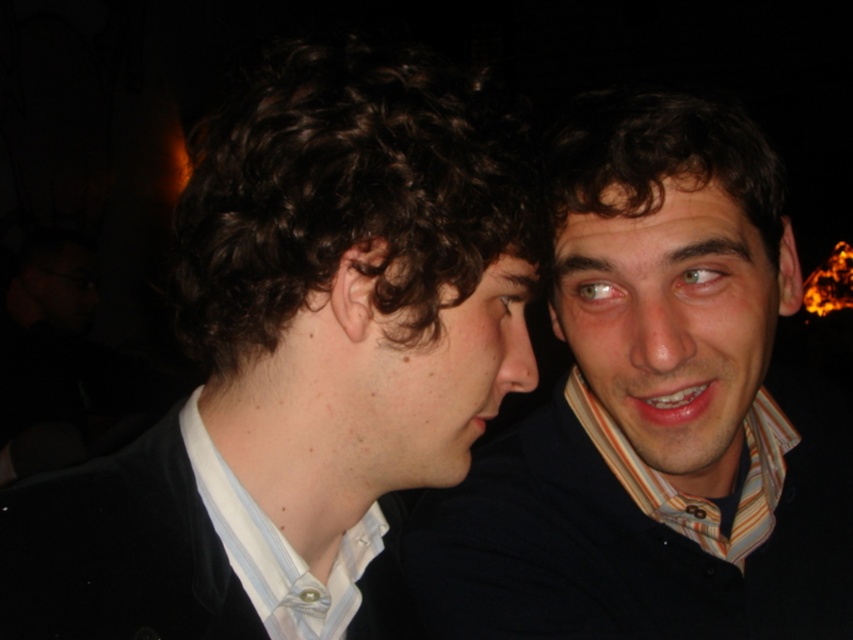
You are standing in a dimly lit room with two people. You see a point at coordinates (300,364). What object is located at that point?

The point at coordinates (300,364) indicates the matte black suit at left.

You are standing at the point marked as point (204, 433) in the image. You want to move to the door located at the far end of the room. Considering your height is 68 inches, will you be able to see the door clearly from your current position?

The distance between you and the viewer is 22.94 inches. Since the door is at the far end of the room, you should be able to see it clearly from your current position unless there are obstructions not mentioned in the scene description.

Based on the photo, you are a photographer who needs to capture a clear photo of both the matte black suit at left and the matte black shirt at center. The camera you are using has a depth of field that can focus on objects within a 9 inch range. Will both items be in focus in the photo?

The matte black suit at left and matte black shirt at center are 8.53 inches apart from each other, which is within the camera depth of field range of 9 inches. Therefore, both items will be in focus in the photo.